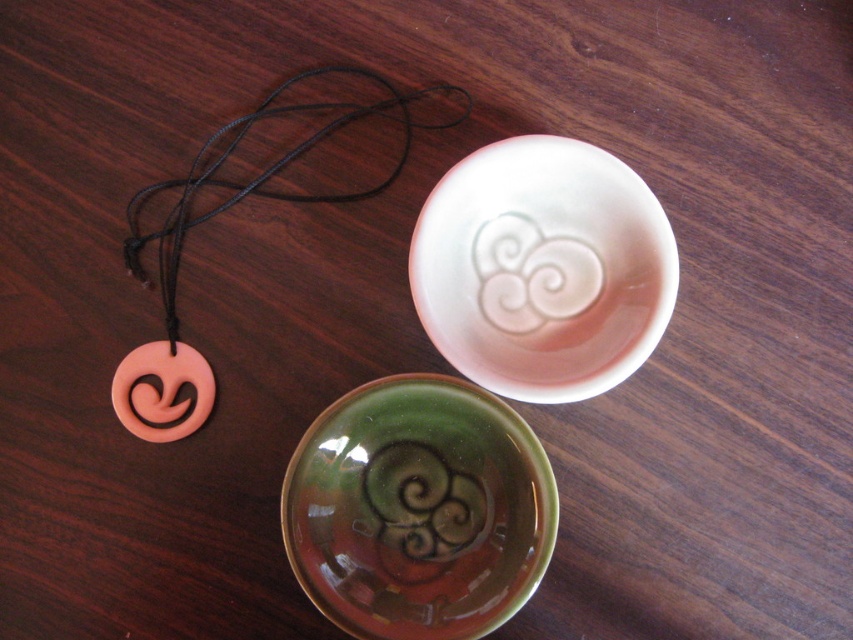
Question: Estimate the real-world distances between objects in this image. Which object is farther from the green glossy swirl at center?

Choices:
 (A) green glossy bowl at center
 (B) white glossy bowl at upper center

Answer: (B)

Question: Does pink matte pendant at upper left have a greater width compared to white glossy swirl at upper center?

Choices:
 (A) yes
 (B) no

Answer: (A)

Question: Does green glossy bowl at center appear over pink matte/porcelain pendant at left?

Choices:
 (A) no
 (B) yes

Answer: (A)

Question: Which object is the farthest from the pink matte/porcelain pendant at left?

Choices:
 (A) pink matte pendant at upper left
 (B) green glossy bowl at center
 (C) white glossy bowl at upper center
 (D) green glossy swirl at center

Answer: (C)

Question: Which object is the closest to the green glossy swirl at center?

Choices:
 (A) white glossy bowl at upper center
 (B) white glossy swirl at upper center

Answer: (B)

Question: Is green glossy bowl at center wider than pink matte/porcelain pendant at left?

Choices:
 (A) yes
 (B) no

Answer: (A)